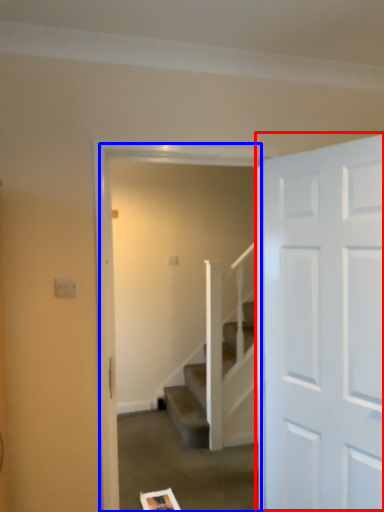
Question: Which object is further to the camera taking this photo, door (highlighted by a red box) or screen door (highlighted by a blue box)?

Choices:
 (A) door
 (B) screen door

Answer: (B)